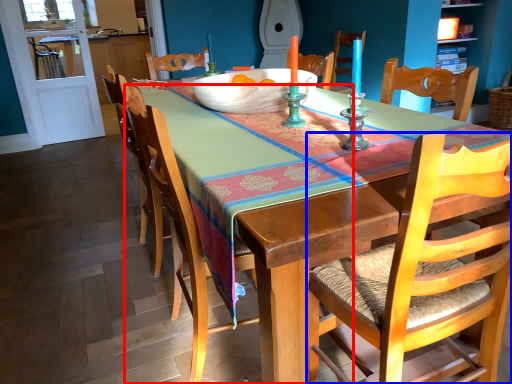
Question: Which object appears farthest to the camera in this image, chair (highlighted by a red box) or chair (highlighted by a blue box)?

Choices:
 (A) chair
 (B) chair

Answer: (A)